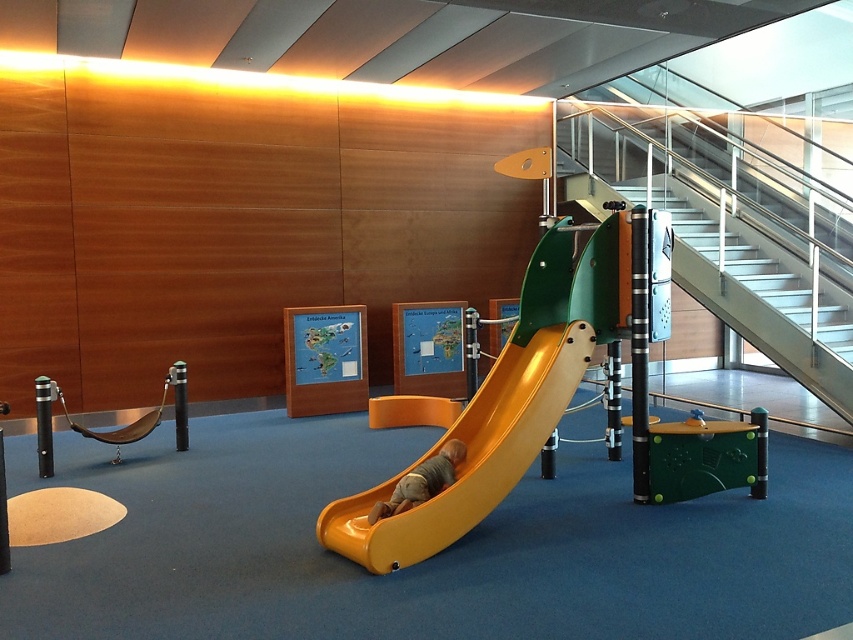
Between yellow matte slide at center and metallic silver stairs at upper right, which one is positioned lower?

yellow matte slide at center is below.

Is point (410, 532) behind point (670, 195)?

No, it is not.

Identify the location of yellow matte slide at center. (469, 454).

Does metallic silver stairs at upper right come in front of smooth yellow slide at center?

No, it is behind smooth yellow slide at center.

What are the coordinates of `metallic silver stairs at upper right` in the screenshot? It's located at (769, 280).

This screenshot has height=640, width=853. I want to click on metallic silver stairs at upper right, so click(x=769, y=280).

Does yellow matte slide at center lie in front of smooth yellow slide at center?

That is True.

The image size is (853, 640). Identify the location of yellow matte slide at center. pyautogui.click(x=469, y=454).

This screenshot has height=640, width=853. Find the location of `yellow matte slide at center`. yellow matte slide at center is located at coordinates (469, 454).